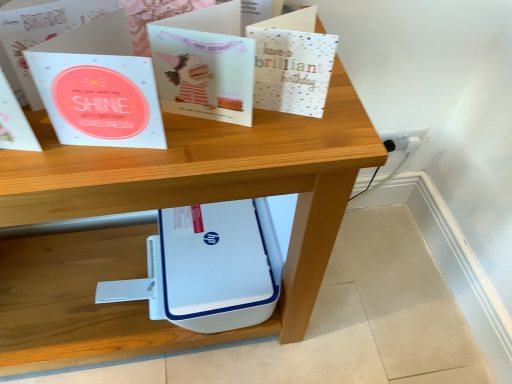
Identify the location of vacant space in front of matte paper card at center, which ranks as the 2th paperback book in right-to-left order. (203, 152).